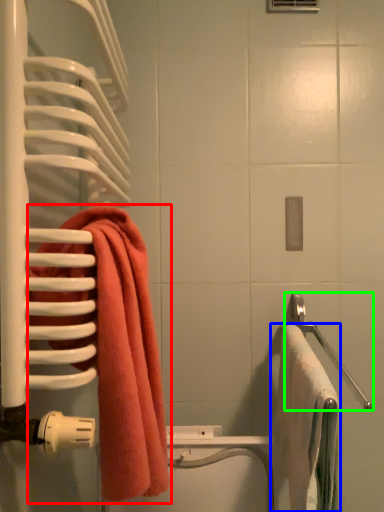
Question: Which object is positioned closest to towel (highlighted by a red box)? Select from towel (highlighted by a blue box) and towel bar (highlighted by a green box).

Choices:
 (A) towel
 (B) towel bar

Answer: (A)